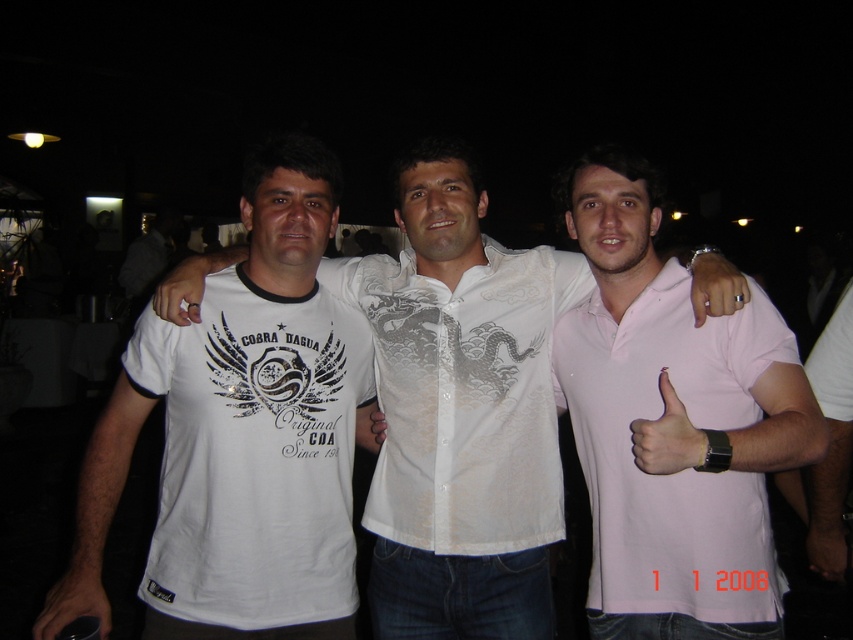
Question: Is white glossy shirt at center thinner than pink cotton polo at center?

Choices:
 (A) yes
 (B) no

Answer: (B)

Question: Observing the image, what is the correct spatial positioning of white printed t-shirt at center in reference to matte white ring at center?

Choices:
 (A) below
 (B) above

Answer: (A)

Question: Which point is farther to the camera?

Choices:
 (A) white glossy shirt at center
 (B) matte skin hand at center

Answer: (A)

Question: Can you confirm if white cotton t-shirt at left is bigger than matte white ring at center?

Choices:
 (A) yes
 (B) no

Answer: (A)

Question: Among these objects, which one is farthest from the camera?

Choices:
 (A) black matte hand at lower left
 (B) white printed t-shirt at center
 (C) silver metallic ring at center
 (D) matte skin hand at center

Answer: (B)

Question: Estimate the real-world distances between objects in this image. Which object is farther from the white printed t-shirt at center?

Choices:
 (A) matte white ring at center
 (B) silver metallic ring at center
 (C) white glossy shirt at center
 (D) pink cotton polo at center

Answer: (A)